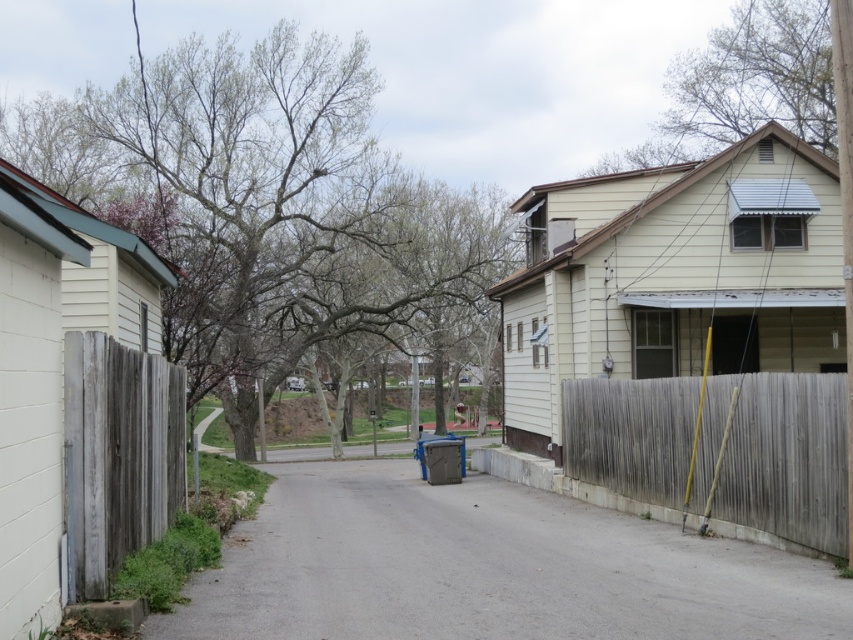
Is weathered wood fence at right bigger than weathered wood fence at left?

Actually, weathered wood fence at right might be smaller than weathered wood fence at left.

Is weathered wood fence at right taller than weathered wood fence at left?

Incorrect, weathered wood fence at right's height is not larger of weathered wood fence at left's.

Where is `weathered wood fence at right`? This screenshot has height=640, width=853. weathered wood fence at right is located at coordinates pos(778,456).

Can you confirm if gray concrete driveway at lower center is positioned to the left of weathered wood fence at left?

Incorrect, gray concrete driveway at lower center is not on the left side of weathered wood fence at left.

Image resolution: width=853 pixels, height=640 pixels. I want to click on gray concrete driveway at lower center, so click(486, 570).

Who is positioned more to the right, gray concrete driveway at lower center or weathered wood fence at right?

weathered wood fence at right is more to the right.

Who is shorter, gray concrete driveway at lower center or weathered wood fence at right?

weathered wood fence at right

The image size is (853, 640). What do you see at coordinates (486, 570) in the screenshot?
I see `gray concrete driveway at lower center` at bounding box center [486, 570].

Locate an element on the screen. The image size is (853, 640). gray concrete driveway at lower center is located at coordinates (486, 570).